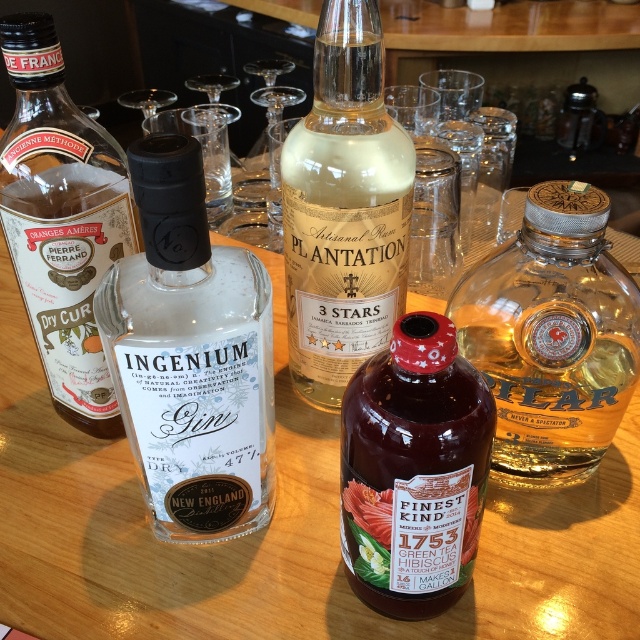
Is clear glass gin at center positioned before purple glass bottle at center?

Yes, it is.

Consider the image. Is clear glass gin at center thinner than purple glass bottle at center?

In fact, clear glass gin at center might be wider than purple glass bottle at center.

Is point (205, 330) in front of point (390, 449)?

No, (205, 330) is further to viewer.

This screenshot has width=640, height=640. In order to click on clear glass gin at center in this screenshot , I will do `click(189, 355)`.

Between clear glass gin at center and translucent glass bottle at right, which one is positioned higher?

translucent glass bottle at right

Who is more distant from viewer, (234, 285) or (516, 349)?

The point (516, 349) is behind.

In order to click on clear glass gin at center in this screenshot , I will do `click(189, 355)`.

Locate an element on the screen. The width and height of the screenshot is (640, 640). clear glass gin at center is located at coordinates (189, 355).

Which is more to the right, translucent glass bottle at right or translucent glass bottle at center?

translucent glass bottle at right is more to the right.

Between point (461, 333) and point (298, 216), which one is positioned behind?

Positioned behind is point (298, 216).

Who is more forward, (x=580, y=241) or (x=300, y=192)?

Point (x=580, y=241) is more forward.

Find the location of `translucent glass bottle at right`. translucent glass bottle at right is located at coordinates (552, 337).